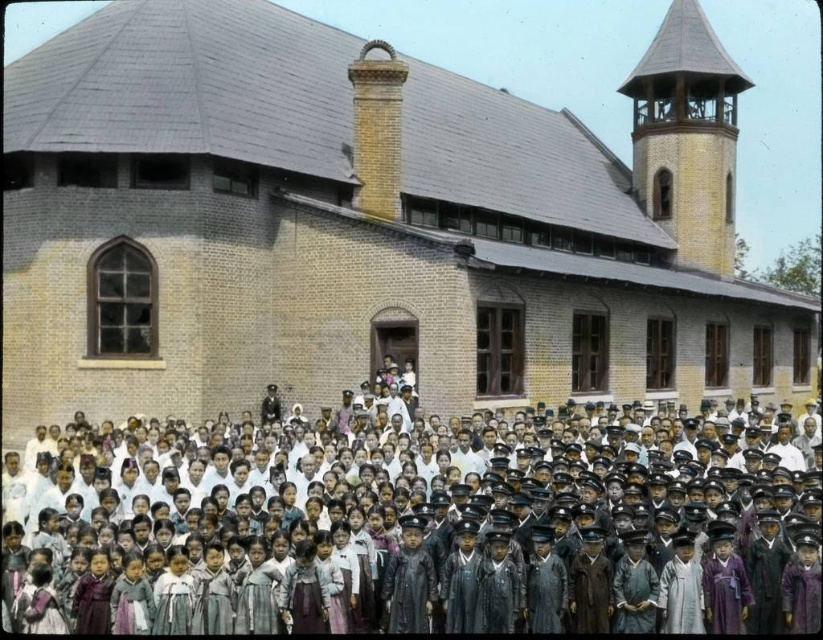
Question: Can you confirm if yellow brick church at center is positioned to the right of wooden spire at upper right?

Choices:
 (A) no
 (B) yes

Answer: (A)

Question: Does dark brown uniform at center come behind wooden spire at upper right?

Choices:
 (A) no
 (B) yes

Answer: (A)

Question: From the image, what is the correct spatial relationship of yellow brick church at center in relation to wooden spire at upper right?

Choices:
 (A) right
 (B) left

Answer: (B)

Question: Which of the following is the farthest from the observer?

Choices:
 (A) dark brown uniform at center
 (B) yellow brick church at center
 (C) wooden spire at upper right

Answer: (C)

Question: Which object appears closest to the camera in this image?

Choices:
 (A) wooden spire at upper right
 (B) yellow brick church at center
 (C) dark brown uniform at center

Answer: (C)

Question: Among these objects, which one is farthest from the camera?

Choices:
 (A) wooden spire at upper right
 (B) dark brown uniform at center
 (C) yellow brick church at center

Answer: (A)